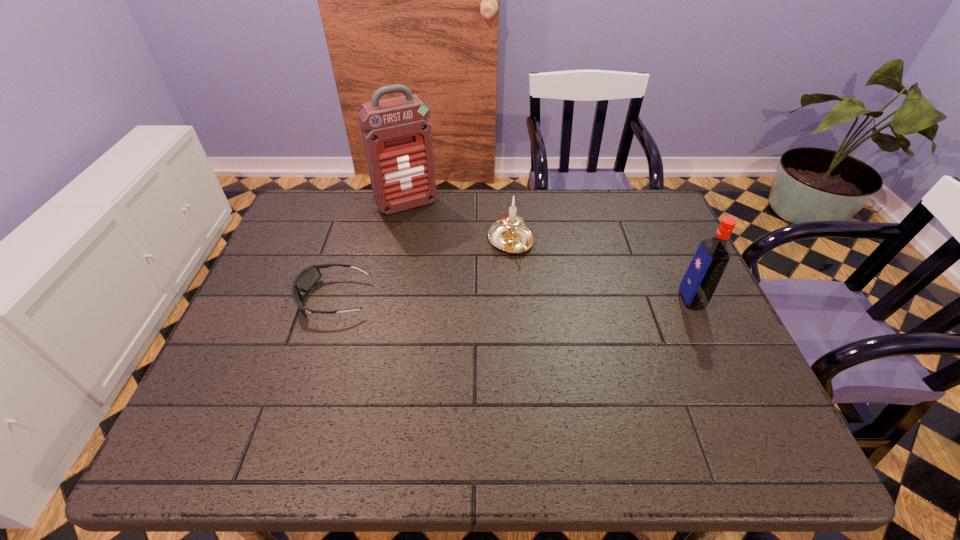
The width and height of the screenshot is (960, 540). Find the location of `the shortest object`. the shortest object is located at coordinates (304, 281).

Locate an element on the screen. the rightmost object is located at coordinates (702, 277).

The width and height of the screenshot is (960, 540). What are the coordinates of `vodka` in the screenshot? It's located at (702, 277).

Identify the location of the farthest object. (397, 137).

Find the location of a particular element. the tallest object is located at coordinates (397, 137).

Find the location of `the second farthest object`. the second farthest object is located at coordinates (509, 234).

The width and height of the screenshot is (960, 540). What are the coordinates of `the third tallest object` in the screenshot? It's located at (509, 234).

This screenshot has width=960, height=540. Identify the location of vacant space located on the lenses of the goggles. (279, 298).

Locate an element on the screen. vacant space located on the lenses of the goggles is located at coordinates (260, 298).

Image resolution: width=960 pixels, height=540 pixels. Find the location of `free space located 0.060m on the lenses of the goggles`. free space located 0.060m on the lenses of the goggles is located at coordinates (276, 298).